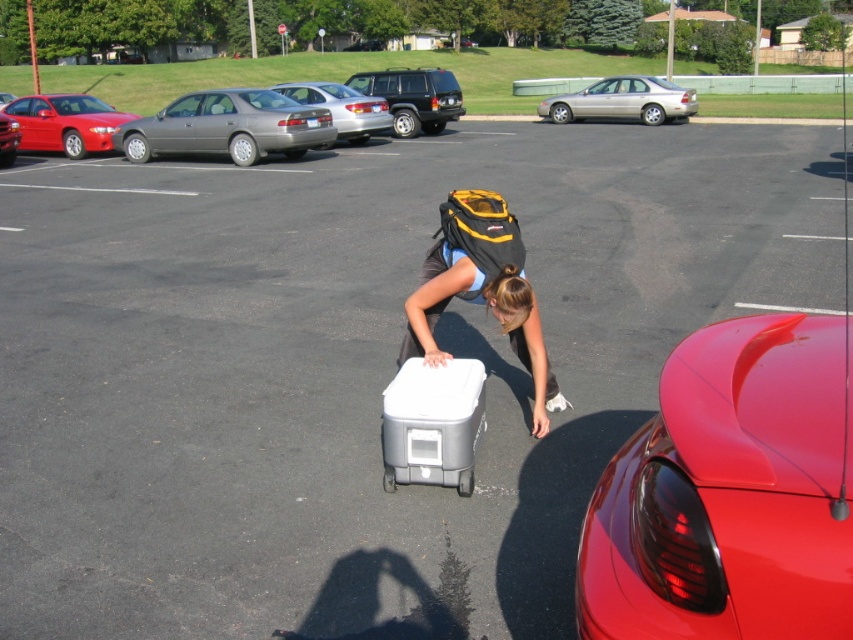
Question: Which point is farther from the camera taking this photo?

Choices:
 (A) (573, 116)
 (B) (12, 134)

Answer: (A)

Question: Which is nearer to the matte black backpack at center?

Choices:
 (A) metallic red car at left
 (B) shiny metallic sedan at left
 (C) satin silver sedan at center

Answer: (C)

Question: Does matte black backpack at center appear on the right side of metallic red car at left?

Choices:
 (A) yes
 (B) no

Answer: (A)

Question: Considering the relative positions of matte black backpack at center and satin silver sedan at center in the image provided, where is matte black backpack at center located with respect to satin silver sedan at center?

Choices:
 (A) above
 (B) below

Answer: (B)

Question: Which of these objects is positioned farthest from the silver metallic suv at center?

Choices:
 (A) satin silver sedan at center
 (B) matte black backpack at center
 (C) satin silver sedan at upper left
 (D) glossy red spoiler at right

Answer: (D)

Question: Does satin silver sedan at upper left have a smaller size compared to silver metallic sedan at center?

Choices:
 (A) no
 (B) yes

Answer: (B)